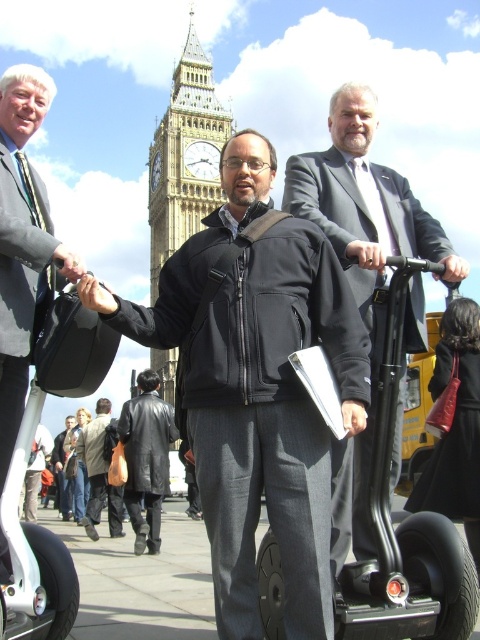
In the scene shown: You are standing at the base of the Elizabeth Tower and want to take a photo of a specific point located at coordinates point (148, 147). If the camera you are using has a focal length of 50mm and the sensor size is 24mm x 36mm, what is the minimum distance you need to move forward or backward to ensure the point is within the camera frame?

The point at (148, 147) is 121.87 meters away from the camera. To ensure the point is within the camera frame, you need to calculate the field of view. With a focal length of 50mm and sensor size 24mm x 36mm, the horizontal field of view is approximately 39.6 degrees. The distance from the camera to the point is already 121.87 meters, so you don not need to move forward or backward as the point is within the frame.